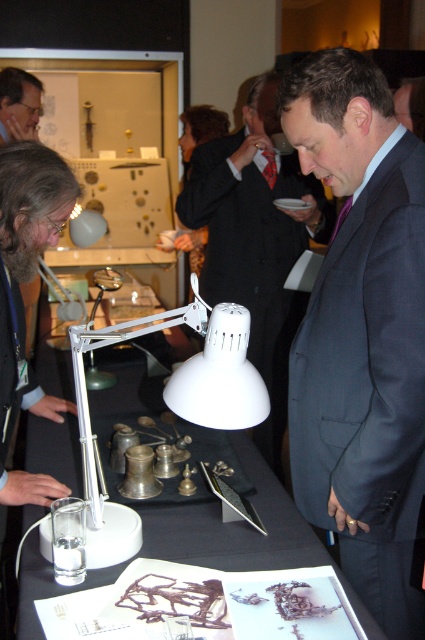
Which is in front, point (314, 225) or point (44, 195)?

Point (44, 195) is in front.

Can you confirm if matte white lamp at center is taller than gray fabric suit at center?

Indeed, matte white lamp at center has a greater height compared to gray fabric suit at center.

Is point (240, 138) positioned behind point (23, 269)?

Yes, it is behind point (23, 269).

In order to click on matte white lamp at center in this screenshot , I will do `click(255, 240)`.

Is the position of gray fabric suit at center more distant than that of matte black beard at upper left?

No, it is not.

Based on the photo, who is shorter, gray fabric suit at center or matte black beard at upper left?

matte black beard at upper left

Which is behind, point (45, 502) or point (17, 104)?

Point (17, 104)

Where is `gray fabric suit at center`? The height and width of the screenshot is (640, 425). gray fabric suit at center is located at coordinates (22, 300).

Does dark gray suit at center have a lesser height compared to gray fabric suit at center?

Incorrect, dark gray suit at center's height does not fall short of gray fabric suit at center's.

Looking at this image, who is more distant from viewer, (x=404, y=445) or (x=67, y=218)?

Positioned behind is point (x=67, y=218).

In order to click on dark gray suit at center in this screenshot , I will do `click(362, 332)`.